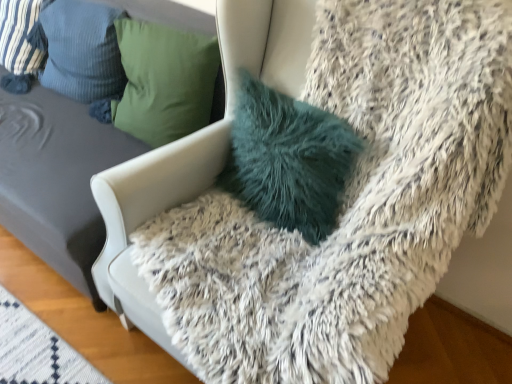
Question: Can teal fuzzy pillow at center, which ranks as the 1th pillow in right-to-left order, be found inside striped fabric pillow at upper left, which is counted as the third pillow, starting from the right?

Choices:
 (A) yes
 (B) no

Answer: (B)

Question: From a real-world perspective, does striped fabric pillow at upper left, which ranks as the first pillow in left-to-right order, stand above teal fuzzy pillow at center, which ranks as the 1th pillow in right-to-left order?

Choices:
 (A) yes
 (B) no

Answer: (A)

Question: From the image's perspective, is striped fabric pillow at upper left, which is counted as the third pillow, starting from the right, located beneath teal fuzzy pillow at center, which ranks as the 1th pillow in right-to-left order?

Choices:
 (A) no
 (B) yes

Answer: (A)

Question: Is striped fabric pillow at upper left, which ranks as the first pillow in left-to-right order, thinner than teal fuzzy pillow at center, which ranks as the 1th pillow in right-to-left order?

Choices:
 (A) yes
 (B) no

Answer: (B)

Question: Is striped fabric pillow at upper left, which is counted as the third pillow, starting from the right, bigger than teal fuzzy pillow at center, which ranks as the 1th pillow in right-to-left order?

Choices:
 (A) no
 (B) yes

Answer: (B)

Question: Is striped fabric pillow at upper left, which is counted as the third pillow, starting from the right, at the right side of teal fuzzy pillow at center, which ranks as the 1th pillow in right-to-left order?

Choices:
 (A) no
 (B) yes

Answer: (A)

Question: Is teal fuzzy pillow at center, which ranks as the 1th pillow in right-to-left order, looking in the opposite direction of fuzzy white chair at upper right?

Choices:
 (A) yes
 (B) no

Answer: (B)

Question: Can you confirm if teal fuzzy pillow at center, which ranks as the 1th pillow in right-to-left order, is shorter than fuzzy white chair at upper right?

Choices:
 (A) no
 (B) yes

Answer: (B)

Question: Does teal fuzzy pillow at center, which ranks as the 1th pillow in right-to-left order, have a greater height compared to fuzzy white chair at upper right?

Choices:
 (A) no
 (B) yes

Answer: (A)

Question: Is teal fuzzy pillow at center, the 3th pillow viewed from the left, not close to fuzzy white chair at upper right?

Choices:
 (A) yes
 (B) no

Answer: (B)

Question: Can fuzzy white chair at upper right be found inside teal fuzzy pillow at center, which ranks as the 1th pillow in right-to-left order?

Choices:
 (A) yes
 (B) no

Answer: (B)

Question: Is teal fuzzy pillow at center, which ranks as the 1th pillow in right-to-left order, not inside fuzzy white chair at upper right?

Choices:
 (A) yes
 (B) no

Answer: (A)

Question: Is teal fuzzy pillow at center, which ranks as the 1th pillow in right-to-left order, thinner than striped fabric pillow at upper left, which is counted as the third pillow, starting from the right?

Choices:
 (A) yes
 (B) no

Answer: (A)